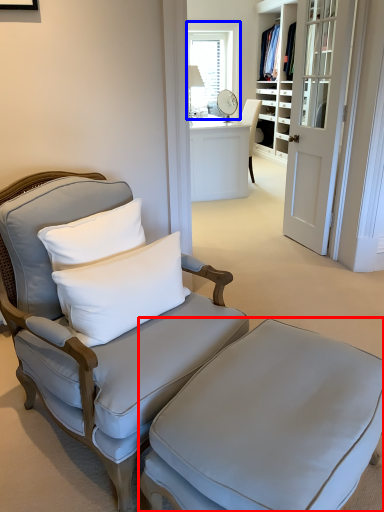
Question: Which point is further to the camera, table (highlighted by a red box) or window (highlighted by a blue box)?

Choices:
 (A) table
 (B) window

Answer: (B)